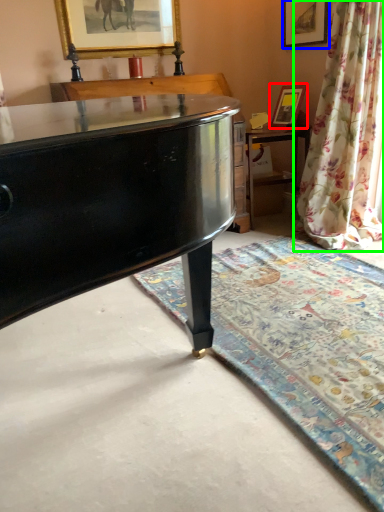
Question: Which object is the closest to the picture frame (highlighted by a red box)? Choose among these: picture frame (highlighted by a blue box) or curtain (highlighted by a green box).

Choices:
 (A) picture frame
 (B) curtain

Answer: (A)